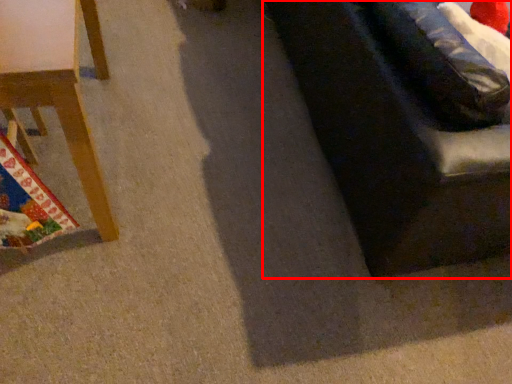
Question: In this image, where is studio couch (annotated by the red box) located relative to furniture?

Choices:
 (A) left
 (B) right

Answer: (B)